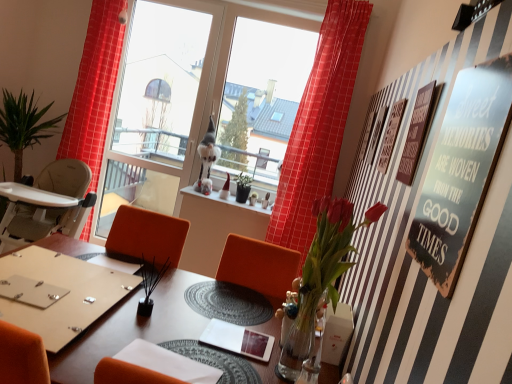
Question: Is wooden plaque at upper right, which is counted as the 1th bulletin board, starting from the back, located outside transparent glass window at center, which is counted as the first window screen, starting from the left?

Choices:
 (A) yes
 (B) no

Answer: (A)

Question: Can you confirm if wooden plaque at upper right, which ranks as the second bulletin board in front-to-back order, is taller than transparent glass window at center, the second window screen positioned from the right?

Choices:
 (A) yes
 (B) no

Answer: (B)

Question: From the image's perspective, is wooden plaque at upper right, which is counted as the 1th bulletin board, starting from the back, on top of transparent glass window at center, which is counted as the first window screen, starting from the left?

Choices:
 (A) yes
 (B) no

Answer: (B)

Question: From a real-world perspective, is wooden plaque at upper right, which is counted as the 1th bulletin board, starting from the back, located higher than transparent glass window at center, the second window screen positioned from the right?

Choices:
 (A) no
 (B) yes

Answer: (A)

Question: Is wooden plaque at upper right, which ranks as the second bulletin board in front-to-back order, bigger than transparent glass window at center, the second window screen positioned from the right?

Choices:
 (A) yes
 (B) no

Answer: (B)

Question: Is point (106, 296) closer or farther from the camera than point (282, 77)?

Choices:
 (A) farther
 (B) closer

Answer: (B)

Question: From the image's perspective, is matte wooden table at center positioned above or below transparent glass window screen at center, positioned as the second window screen in left-to-right order?

Choices:
 (A) above
 (B) below

Answer: (B)

Question: Considering the positions of matte wooden table at center and transparent glass window screen at center, positioned as the second window screen in left-to-right order, in the image, is matte wooden table at center taller or shorter than transparent glass window screen at center, positioned as the second window screen in left-to-right order,?

Choices:
 (A) tall
 (B) short

Answer: (B)

Question: Looking at their shapes, would you say matte wooden table at center is wider or thinner than transparent glass window screen at center, which appears as the first window screen when viewed from the right?

Choices:
 (A) thin
 (B) wide

Answer: (B)

Question: Does point (152, 324) appear closer or farther from the camera than point (53, 352)?

Choices:
 (A) farther
 (B) closer

Answer: (A)

Question: Is wooden table at center in front of or behind matte wooden table at center in the image?

Choices:
 (A) front
 (B) behind

Answer: (A)

Question: Looking at their shapes, would you say wooden table at center is wider or thinner than matte wooden table at center?

Choices:
 (A) wide
 (B) thin

Answer: (A)

Question: From a real-world perspective, is wooden table at center physically located above or below matte wooden table at center?

Choices:
 (A) below
 (B) above

Answer: (A)

Question: Is point (358, 190) closer or farther from the camera than point (198, 322)?

Choices:
 (A) farther
 (B) closer

Answer: (A)

Question: Is wooden plaque at upper right, which is counted as the 1th bulletin board, starting from the back, to the left or to the right of wooden table at center in the image?

Choices:
 (A) right
 (B) left

Answer: (A)